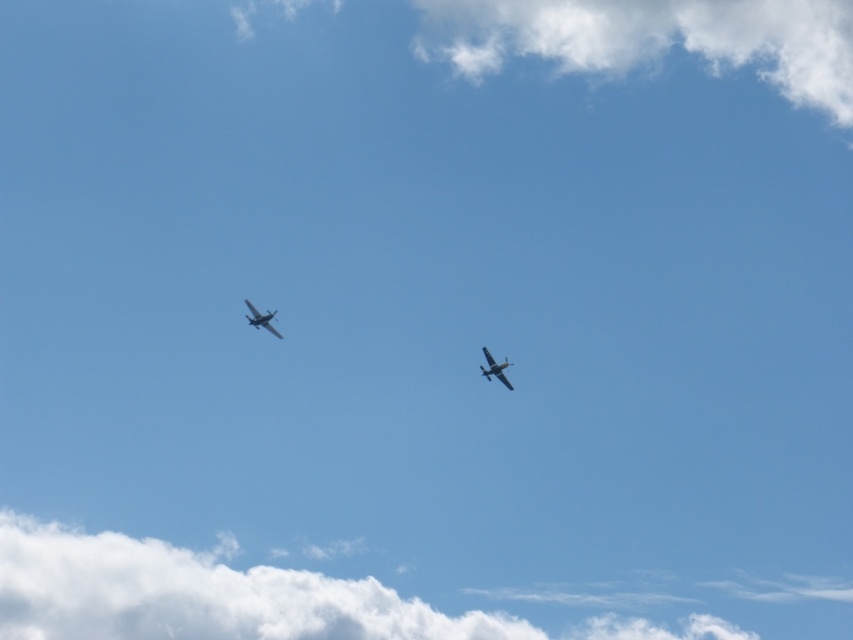
Question: Does white fluffy cloud at upper center appear under metallic silver airplane at upper center?

Choices:
 (A) no
 (B) yes

Answer: (A)

Question: Which of these objects is positioned farthest from the white fluffy cloud at upper center?

Choices:
 (A) metallic silver airplane at upper center
 (B) white fluffy cloud at lower left
 (C) metallic silver airplane at upper left

Answer: (C)

Question: Based on their relative distances, which object is nearer to the white fluffy cloud at lower left?

Choices:
 (A) metallic silver airplane at upper center
 (B) metallic silver airplane at upper left

Answer: (B)

Question: Can you confirm if white fluffy cloud at lower left is smaller than metallic silver airplane at upper left?

Choices:
 (A) yes
 (B) no

Answer: (B)

Question: Observing the image, what is the correct spatial positioning of white fluffy cloud at lower left in reference to metallic silver airplane at upper center?

Choices:
 (A) below
 (B) above

Answer: (A)

Question: Considering the real-world distances, which object is farthest from the white fluffy cloud at lower left?

Choices:
 (A) white fluffy cloud at upper center
 (B) metallic silver airplane at upper left

Answer: (B)